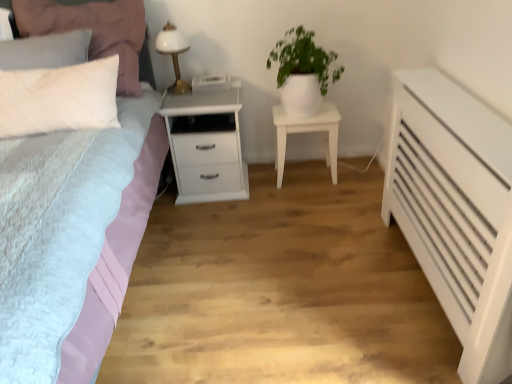
Question: From a real-world perspective, is white matte pot at upper center above or below white matte nightstand at center, positioned as the 2th nightstand in left-to-right order?

Choices:
 (A) below
 (B) above

Answer: (B)

Question: Considering their positions, is white matte pot at upper center located in front of or behind white matte nightstand at center, positioned as the 2th nightstand in left-to-right order?

Choices:
 (A) front
 (B) behind

Answer: (A)

Question: Based on their relative distances, which object is nearer to the white glossy bedside lamp at upper left?

Choices:
 (A) white matte nightstand at center, positioned as the 2th nightstand in left-to-right order
 (B) white quilted pillow at upper left
 (C) white matte pot at upper center
 (D) white glossy nightstand at center, which appears as the second nightstand when viewed from the right
 (E) matte pink bed at left

Answer: (B)

Question: Which of these objects is positioned closest to the white matte nightstand at center, the 1th nightstand viewed from the right?

Choices:
 (A) white glossy bedside lamp at upper left
 (B) white quilted pillow at upper left
 (C) white glossy nightstand at center, which is the first nightstand from left to right
 (D) white matte pot at upper center
 (E) matte pink bed at left

Answer: (D)